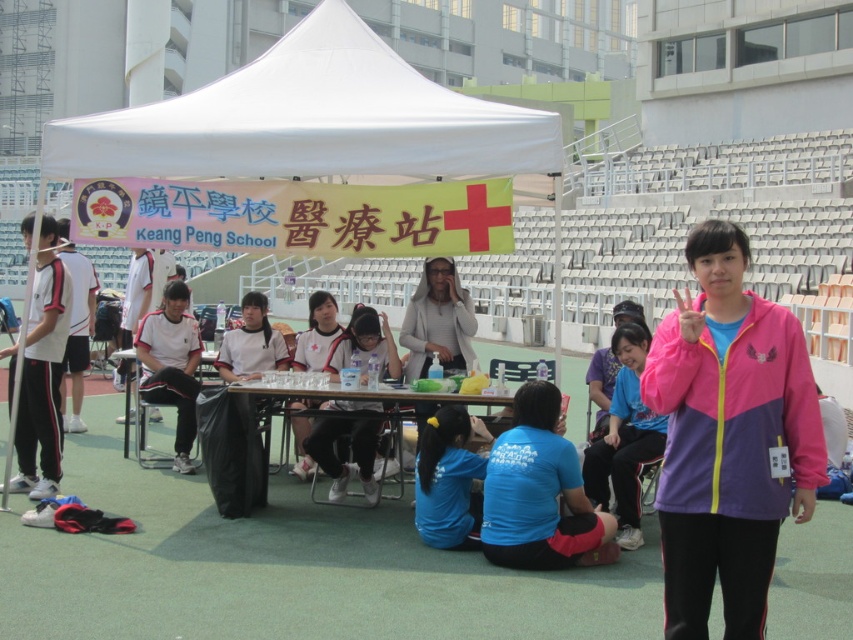
Can you confirm if white fabric canopy at upper center is positioned below pink fabric jacket at center?

Actually, white fabric canopy at upper center is above pink fabric jacket at center.

Measure the distance between point (x=310, y=22) and camera.

7.06 meters

Between point (379, 40) and point (764, 612), which one is positioned in front?

Point (764, 612) is more forward.

Locate an element on the screen. This screenshot has width=853, height=640. white fabric canopy at upper center is located at coordinates (311, 120).

Is point (749, 504) more distant than point (614, 436)?

No, (749, 504) is closer to viewer.

Is point (659, 381) closer to viewer compared to point (614, 413)?

Yes, point (659, 381) is closer to viewer.

Where is `pink fabric jacket at center`? This screenshot has width=853, height=640. pink fabric jacket at center is located at coordinates (728, 438).

Image resolution: width=853 pixels, height=640 pixels. I want to click on pink fabric jacket at center, so click(x=728, y=438).

Who is positioned more to the left, pink fabric jacket at center or wooden table at center?

wooden table at center

Can you confirm if pink fabric jacket at center is positioned above wooden table at center?

Indeed, pink fabric jacket at center is positioned over wooden table at center.

You are a GUI agent. You are given a task and a screenshot of the screen. Output one action in this format:
    pyautogui.click(x=<x>, y=<y>)
    Task: Click on the pink fabric jacket at center
    The image size is (853, 640).
    Given the screenshot: What is the action you would take?
    pyautogui.click(x=728, y=438)

Find the location of a particular element. pink fabric jacket at center is located at coordinates (728, 438).